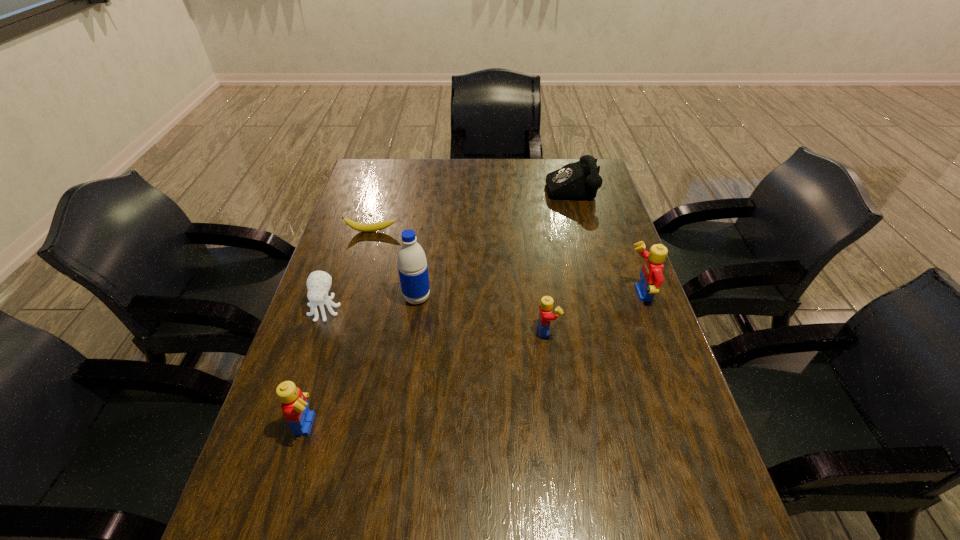
Where is `vacant space that satisfies the following two spatial constraints: 1. on the front side of the water bottle; 2. on the face of the third tallest object`? The image size is (960, 540). vacant space that satisfies the following two spatial constraints: 1. on the front side of the water bottle; 2. on the face of the third tallest object is located at coordinates (399, 423).

You are a GUI agent. You are given a task and a screenshot of the screen. Output one action in this format:
    pyautogui.click(x=<x>, y=<y>)
    Task: Click on the vacant space that satisfies the following two spatial constraints: 1. on the face of the farthest Lego; 2. on the front side of the fourth object from left to right
    
    Given the screenshot: What is the action you would take?
    639,298